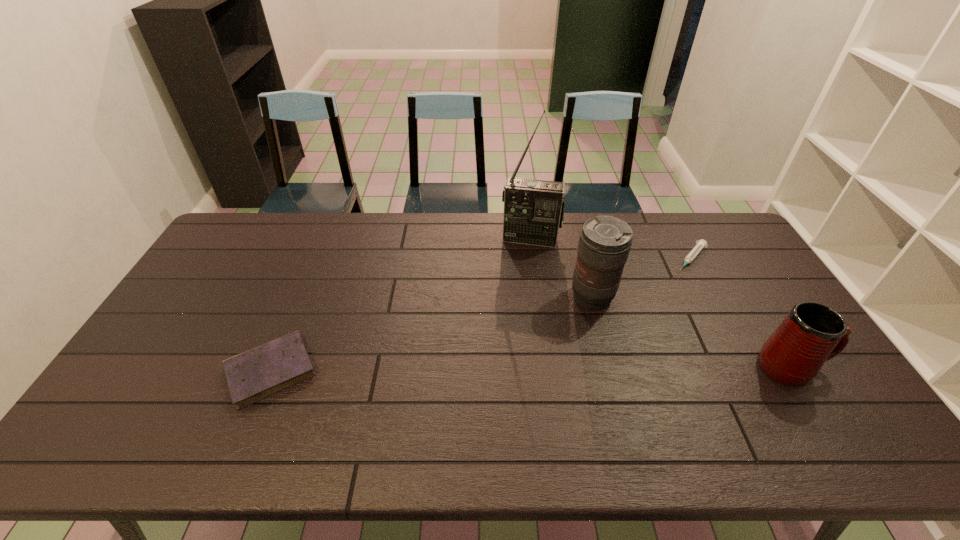
You are a GUI agent. You are given a task and a screenshot of the screen. Output one action in this format:
    pyautogui.click(x=<x>, y=<y>)
    Task: Click on the free space on the desktop that is between the diary and the mug and is positioned on the side of the telephoto lens where the control switches are located
    This screenshot has width=960, height=540.
    Given the screenshot: What is the action you would take?
    pyautogui.click(x=539, y=369)

Find the location of a particular element. free spot on the desktop that is between the diary and the third shortest object and is positioned at the needle end of the syringe is located at coordinates (600, 368).

Where is `vacant space on the desktop that is between the diary and the mug and is positioned on the display of the tallest object`? vacant space on the desktop that is between the diary and the mug and is positioned on the display of the tallest object is located at coordinates (510, 369).